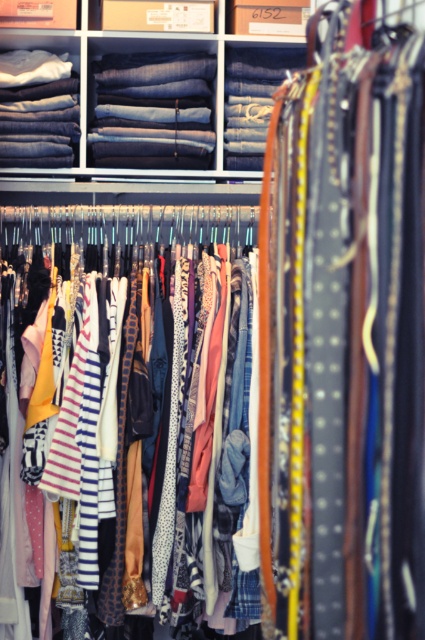
Question: Can you confirm if denim jeans at upper center is wider than denim at upper center?

Choices:
 (A) no
 (B) yes

Answer: (B)

Question: Considering the real-world distances, which object is farthest from the denim jeans at upper center?

Choices:
 (A) printed fabric dress at center
 (B) denim jeans at upper left
 (C) denim at upper center

Answer: (A)

Question: Which is nearer to the denim fabric jeans at upper center?

Choices:
 (A) denim at upper center
 (B) printed fabric dress at center
 (C) denim jeans at upper left

Answer: (C)

Question: Can you confirm if denim fabric jeans at upper center is positioned to the left of denim jeans at upper left?

Choices:
 (A) yes
 (B) no

Answer: (B)

Question: Is the position of denim fabric jeans at upper center less distant than that of denim jeans at upper center?

Choices:
 (A) yes
 (B) no

Answer: (A)

Question: Which object appears farthest from the camera in this image?

Choices:
 (A) denim fabric jeans at upper center
 (B) denim jeans at upper center
 (C) denim at upper center
 (D) printed fabric dress at center

Answer: (C)